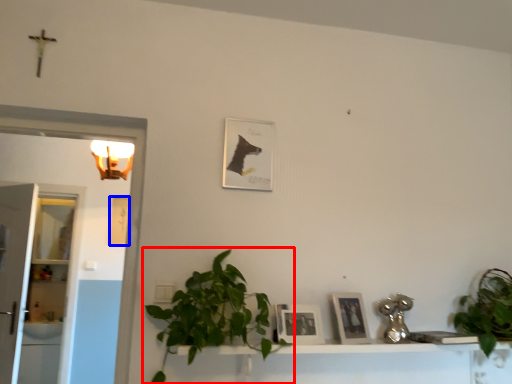
Question: Which point is further to the camera, houseplant (highlighted by a red box) or picture frame (highlighted by a blue box)?

Choices:
 (A) houseplant
 (B) picture frame

Answer: (B)